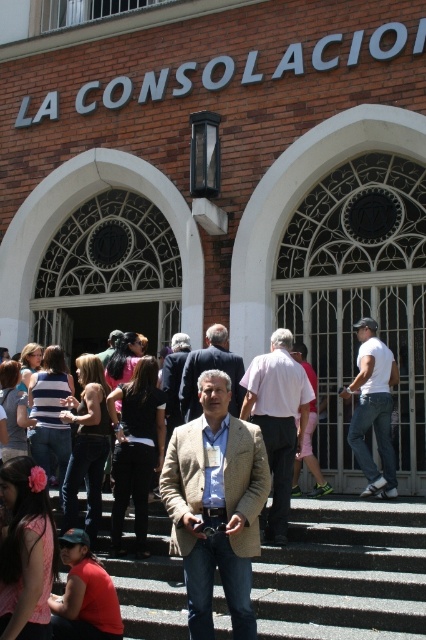
You are a photographer standing in front of the LA CONSOLACION building. You notice a man wearing a tan textured blazer at center and another person wearing a white matte shirt at right. Which clothing item is shorter in height?

The tan textured blazer at center is not as tall as the white matte shirt at right, so the tan textured blazer at center is shorter in height.

You are standing at the entrance of LA CONSOLACION building and see two points marked on the ground. The first point is at coordinate point (212, 344) and the second is at point (178, 368). If you want to walk towards the point that is closer to the building entrance, which coordinate should you head towards?

Point (212, 344) is in front of point (178, 368), so you should head towards point (212, 344) as it is closer to the building entrance.

You are standing at the entrance of LA CONSOLACION building and see two points marked on the ground. One is at point [354,557] and the other at point [232,362]. Which point is closer to you as you face the building?

Point [354,557] is in front of point [232,362], so it is closer to you as you face the building.